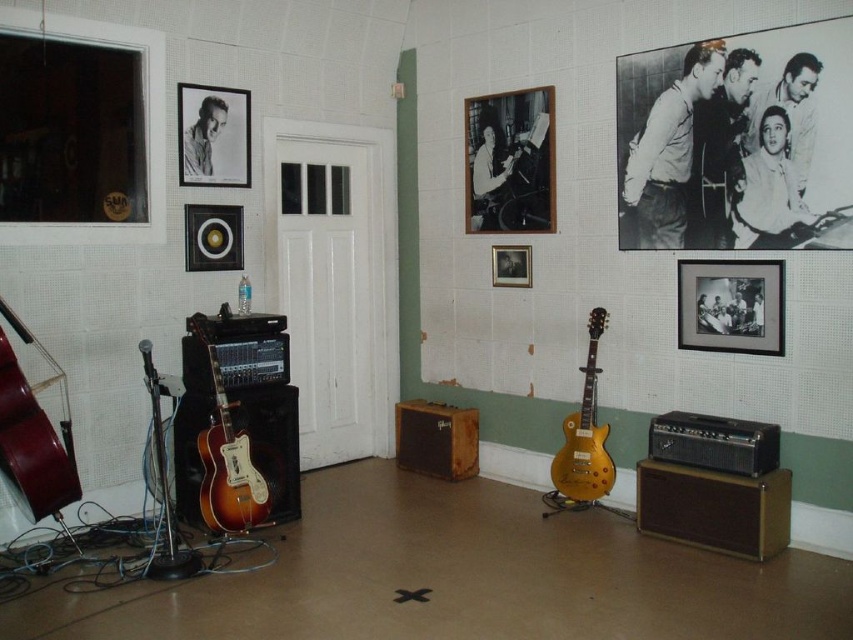
Question: Does wooden framed photograph at center come in front of matte plastic speaker at upper left?

Choices:
 (A) no
 (B) yes

Answer: (A)

Question: Which object appears closest to the camera in this image?

Choices:
 (A) sunburst wood electric guitar at center
 (B) matte plastic speaker at upper left
 (C) mahogany wood cello at left
 (D) black matte picture frame at center right

Answer: (C)

Question: Which point is closer to the camera?

Choices:
 (A) (26, 513)
 (B) (235, 260)
 (C) (505, 273)

Answer: (A)

Question: Can you confirm if sunburst wood electric guitar at center is smaller than matte plastic speaker at upper left?

Choices:
 (A) yes
 (B) no

Answer: (B)

Question: Which of the following is the farthest from the observer?

Choices:
 (A) (506, 248)
 (B) (27, 468)

Answer: (A)

Question: Does wooden framed photograph at center appear on the left side of mahogany wood cello at left?

Choices:
 (A) no
 (B) yes

Answer: (A)